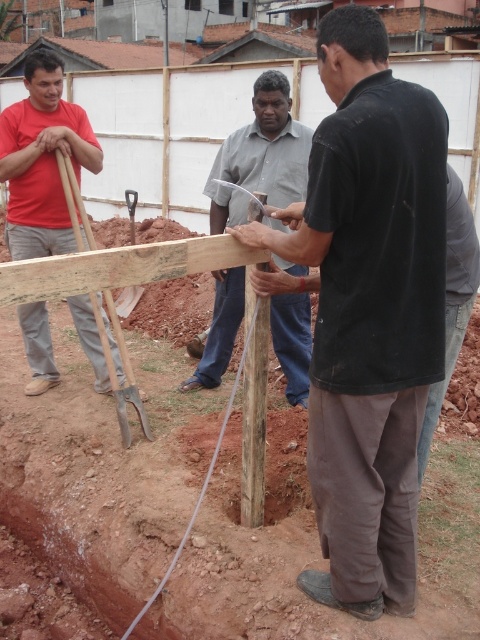
You are a construction worker standing at the edge of the site. You need to locate the black matte shirt at center. According to the coordinates provided, where should you look to find it?

The black matte shirt at center is located at point 0.486 on the x axis and 0.769 on the y axis.

You are a construction worker observing the scene. You notice the matte red shirt at left and the smooth gray shirt at center. Which worker is taller?

The matte red shirt at left is taller than the smooth gray shirt at center.